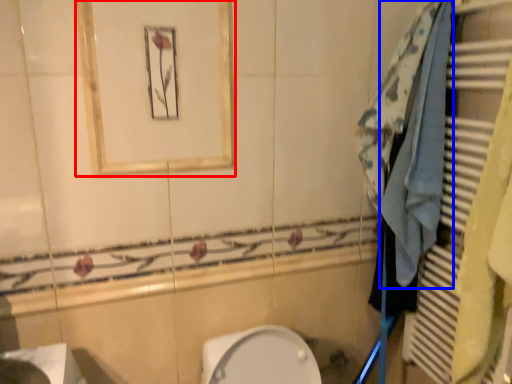
Question: Which point is closer to the camera, medicine cabinet (highlighted by a red box) or bath towel (highlighted by a blue box)?

Choices:
 (A) medicine cabinet
 (B) bath towel

Answer: (A)